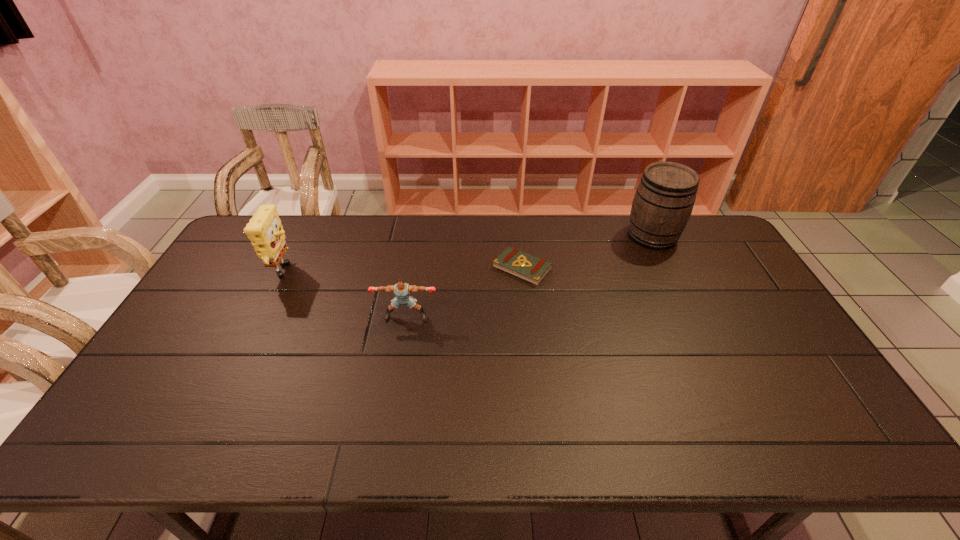
This screenshot has height=540, width=960. I want to click on wine bucket, so click(665, 196).

Find the location of a particular element. The width and height of the screenshot is (960, 540). the leftmost object is located at coordinates click(x=264, y=230).

Where is `sponge`? Image resolution: width=960 pixels, height=540 pixels. sponge is located at coordinates (264, 230).

What are the coordinates of `the second shortest object` in the screenshot? It's located at (402, 290).

Where is `puncher`? This screenshot has width=960, height=540. puncher is located at coordinates (402, 290).

At what (x,y) coordinates should I click in order to perform the action: click on the shortest object. Please return your answer as a coordinate pair (x, y). This screenshot has height=540, width=960. Looking at the image, I should click on (512, 261).

Locate an element on the screen. The height and width of the screenshot is (540, 960). book is located at coordinates (512, 261).

At what (x,y) coordinates should I click in order to perform the action: click on vacant position located 0.380m on the left of the rightmost object. Please return your answer as a coordinate pair (x, y). Looking at the image, I should click on (520, 236).

The height and width of the screenshot is (540, 960). I want to click on free space located 0.180m on the face of the leftmost object, so click(x=351, y=274).

You are a GUI agent. You are given a task and a screenshot of the screen. Output one action in this format:
    pyautogui.click(x=<x>, y=<y>)
    Task: Click on the vacant point located 0.170m on the front-facing side of the second shortest object
    This screenshot has width=960, height=540.
    Given the screenshot: What is the action you would take?
    pyautogui.click(x=397, y=370)